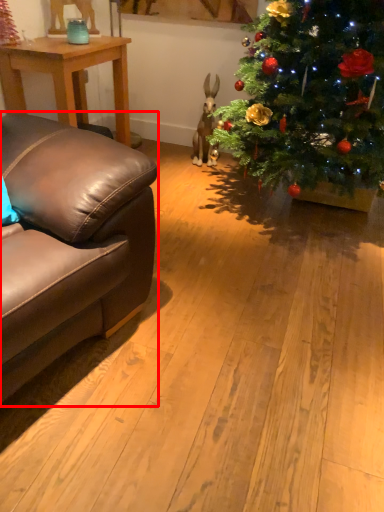
Question: Observing the image, what is the correct spatial positioning of studio couch (annotated by the red box) in reference to table?

Choices:
 (A) right
 (B) left

Answer: (A)